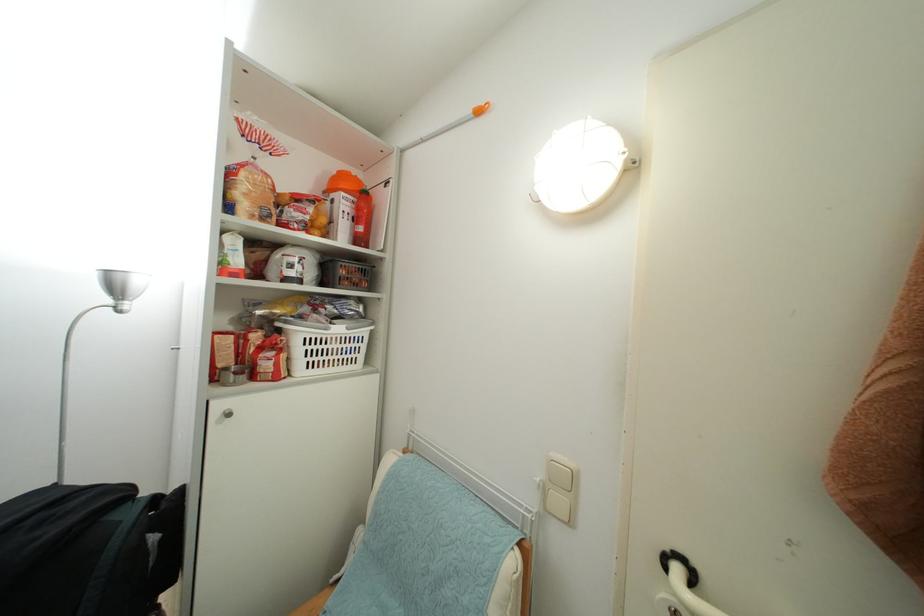
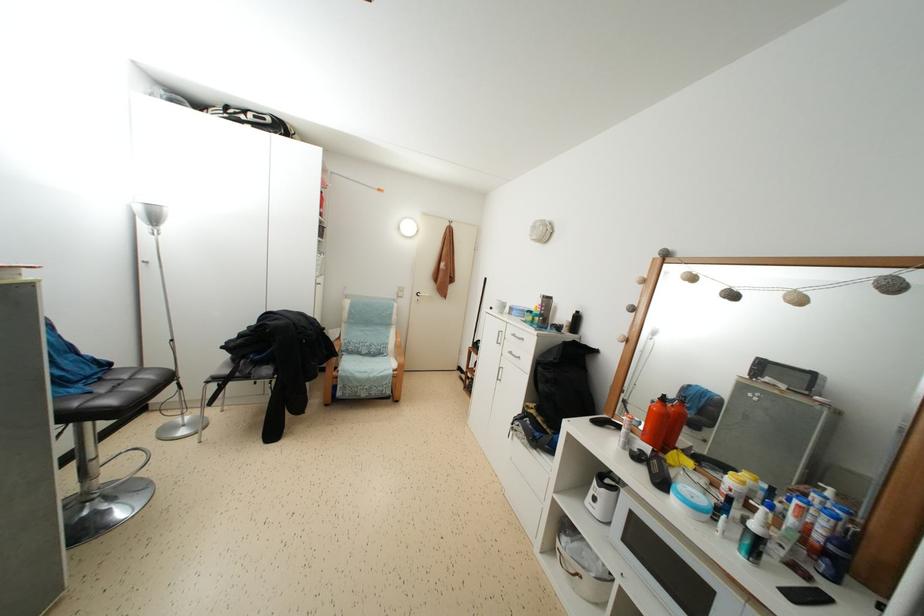
Question: I am providing you with two images of the same scene from different viewpoints. After the viewpoint changes to image2, which objects are now occluded?

Choices:
 (A) gray chair sitting surface
 (B) clear box handle
 (C) orange plastic colander
 (D) white plastic basket

Answer: (C)